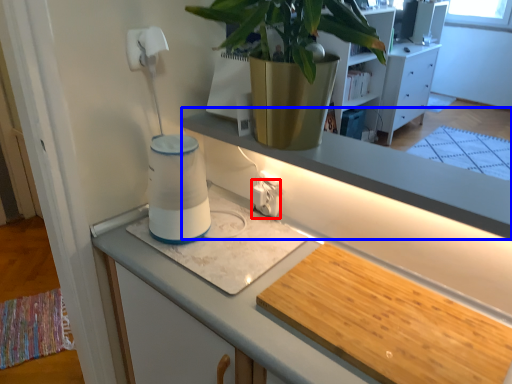
Question: Among these objects, which one is farthest to the camera, electric outlet (highlighted by a red box) or window sill (highlighted by a blue box)?

Choices:
 (A) electric outlet
 (B) window sill

Answer: (A)